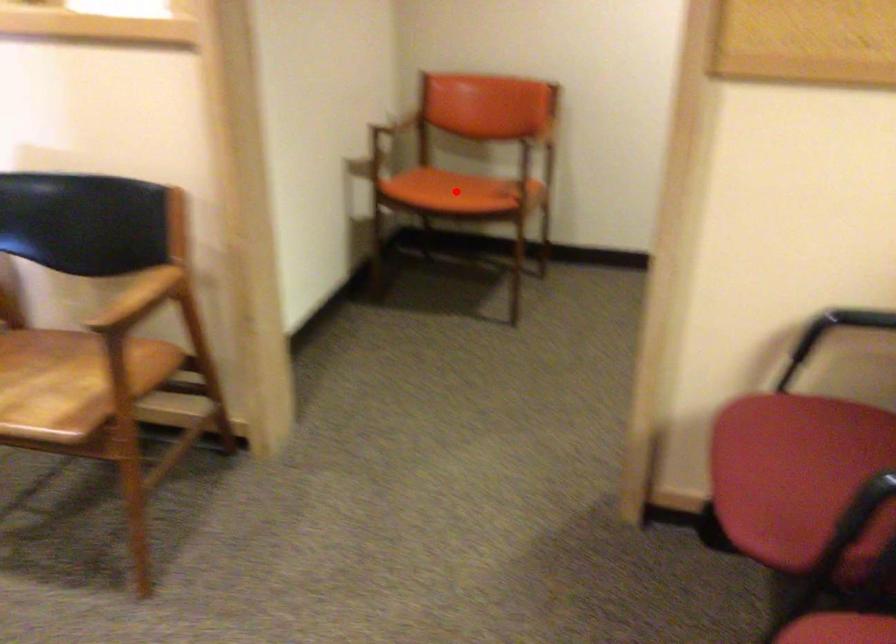
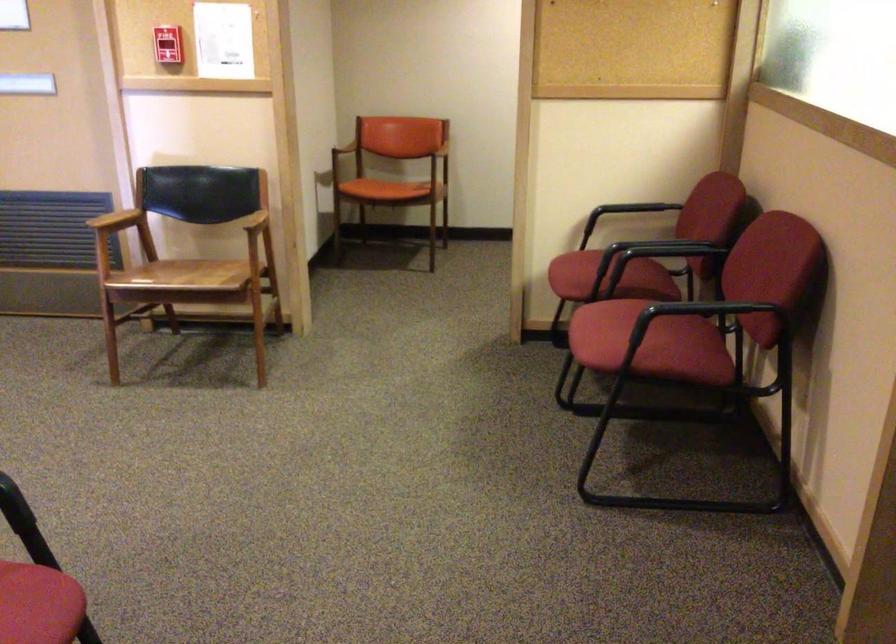
Question: I am providing you with two images of the same scene from different viewpoints. A red point is shown in image1. For the corresponding object point in image2, is it positioned nearer or farther from the camera?

Choices:
 (A) Nearer
 (B) Farther

Answer: (B)